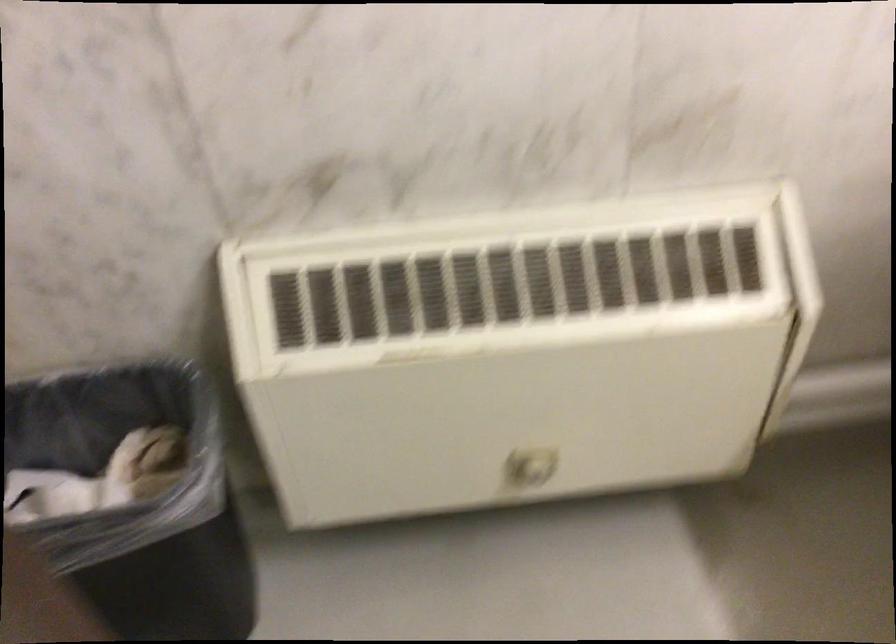
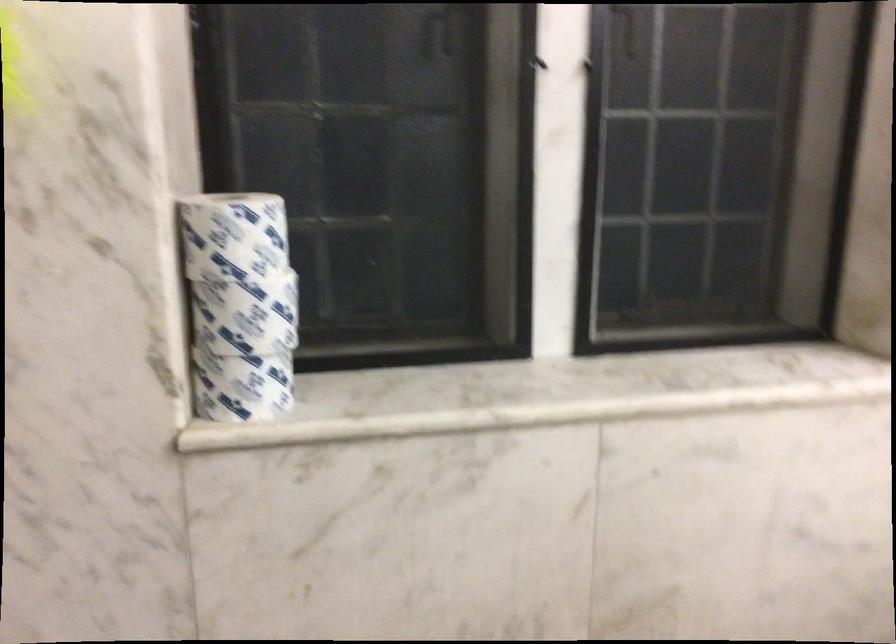
Question: The first image is from the beginning of the video and the second image is from the end. How did the camera likely rotate when shooting the video?

Choices:
 (A) Left
 (B) Right
 (C) Up
 (D) Down

Answer: (C)